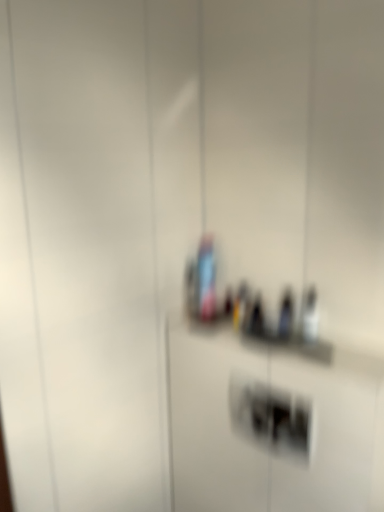
Question: Does point (274, 438) appear closer or farther from the camera than point (210, 262)?

Choices:
 (A) farther
 (B) closer

Answer: (B)

Question: Is white plastic light switch at center wider or thinner than translucent glass bottle at center?

Choices:
 (A) wide
 (B) thin

Answer: (B)

Question: Considering their positions, is white plastic light switch at center located in front of or behind translucent glass bottle at center?

Choices:
 (A) front
 (B) behind

Answer: (A)

Question: Is translucent glass bottle at center situated inside white plastic light switch at center or outside?

Choices:
 (A) inside
 (B) outside

Answer: (B)

Question: In terms of height, does translucent glass bottle at center look taller or shorter compared to white plastic light switch at center?

Choices:
 (A) tall
 (B) short

Answer: (A)

Question: In the image, is translucent glass bottle at center positioned in front of or behind white plastic light switch at center?

Choices:
 (A) front
 (B) behind

Answer: (B)

Question: Is translucent glass bottle at center wider or thinner than white plastic light switch at center?

Choices:
 (A) thin
 (B) wide

Answer: (B)